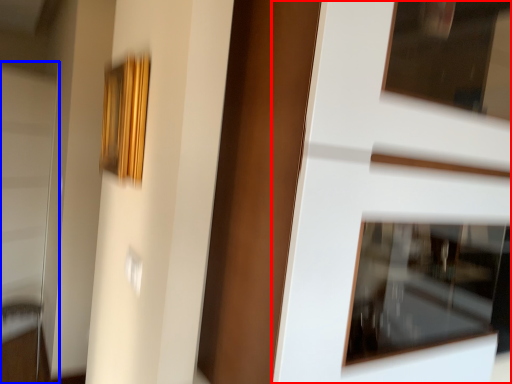
Question: Which of the following is the closest to the observer, door (highlighted by a red box) or screen door (highlighted by a blue box)?

Choices:
 (A) door
 (B) screen door

Answer: (A)